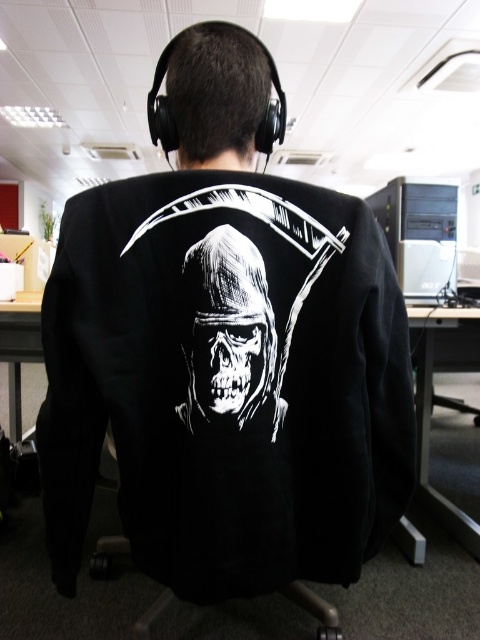
Question: Based on their relative distances, which object is nearer to the black matte jacket at center?

Choices:
 (A) black plastic computer tower at right
 (B) white glossy skull at center

Answer: (B)

Question: Which point appears farthest from the camera in this image?

Choices:
 (A) (203, 244)
 (B) (410, 221)

Answer: (B)

Question: Is black matte jacket at center closer to camera compared to white glossy skull at center?

Choices:
 (A) no
 (B) yes

Answer: (B)

Question: Is white glossy skull at center to the left of black plastic computer tower at right from the viewer's perspective?

Choices:
 (A) yes
 (B) no

Answer: (A)

Question: Among these objects, which one is nearest to the camera?

Choices:
 (A) black matte jacket at center
 (B) black plastic computer tower at right
 (C) white glossy skull at center

Answer: (A)

Question: Where is white glossy skull at center located in relation to black plastic computer tower at right in the image?

Choices:
 (A) below
 (B) above

Answer: (A)